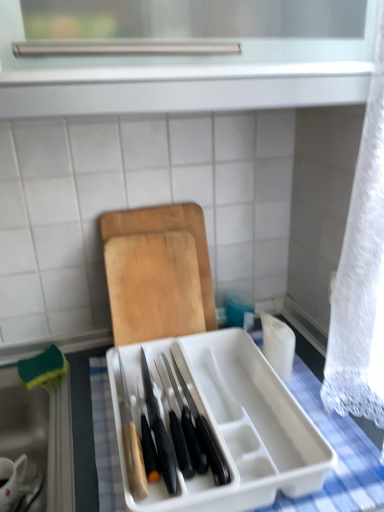
Question: Can we say white plastic knife block at center lies outside white ceramic mug at lower left?

Choices:
 (A) yes
 (B) no

Answer: (A)

Question: Can you confirm if white plastic knife block at center is smaller than white ceramic mug at lower left?

Choices:
 (A) no
 (B) yes

Answer: (A)

Question: Considering the relative positions of white plastic knife block at center and white ceramic mug at lower left in the image provided, is white plastic knife block at center to the right of white ceramic mug at lower left from the viewer's perspective?

Choices:
 (A) no
 (B) yes

Answer: (B)

Question: Considering the relative sizes of white plastic knife block at center and white ceramic mug at lower left in the image provided, is white plastic knife block at center taller than white ceramic mug at lower left?

Choices:
 (A) no
 (B) yes

Answer: (A)

Question: Is white plastic knife block at center positioned behind white ceramic mug at lower left?

Choices:
 (A) yes
 (B) no

Answer: (B)

Question: From a real-world perspective, is wooden cutting board at center above or below white plastic knife block at center?

Choices:
 (A) above
 (B) below

Answer: (A)

Question: In terms of height, does wooden cutting board at center look taller or shorter compared to white plastic knife block at center?

Choices:
 (A) short
 (B) tall

Answer: (B)

Question: Is point (173, 261) positioned closer to the camera than point (286, 489)?

Choices:
 (A) farther
 (B) closer

Answer: (A)

Question: In the image, is wooden cutting board at center positioned in front of or behind white plastic knife block at center?

Choices:
 (A) front
 (B) behind

Answer: (B)

Question: From a real-world perspective, relative to white plastic knife block at center, is white ceramic mug at lower left vertically above or below?

Choices:
 (A) below
 (B) above

Answer: (A)

Question: Looking at their shapes, would you say white ceramic mug at lower left is wider or thinner than white plastic knife block at center?

Choices:
 (A) thin
 (B) wide

Answer: (A)

Question: Considering their positions, is white ceramic mug at lower left located in front of or behind white plastic knife block at center?

Choices:
 (A) behind
 (B) front

Answer: (A)

Question: From the image's perspective, is white ceramic mug at lower left above or below white plastic knife block at center?

Choices:
 (A) below
 (B) above

Answer: (A)

Question: Considering the positions of wooden cutting board at center and white ceramic mug at lower left in the image, is wooden cutting board at center wider or thinner than white ceramic mug at lower left?

Choices:
 (A) thin
 (B) wide

Answer: (A)

Question: Is wooden cutting board at center spatially inside white ceramic mug at lower left, or outside of it?

Choices:
 (A) outside
 (B) inside

Answer: (A)